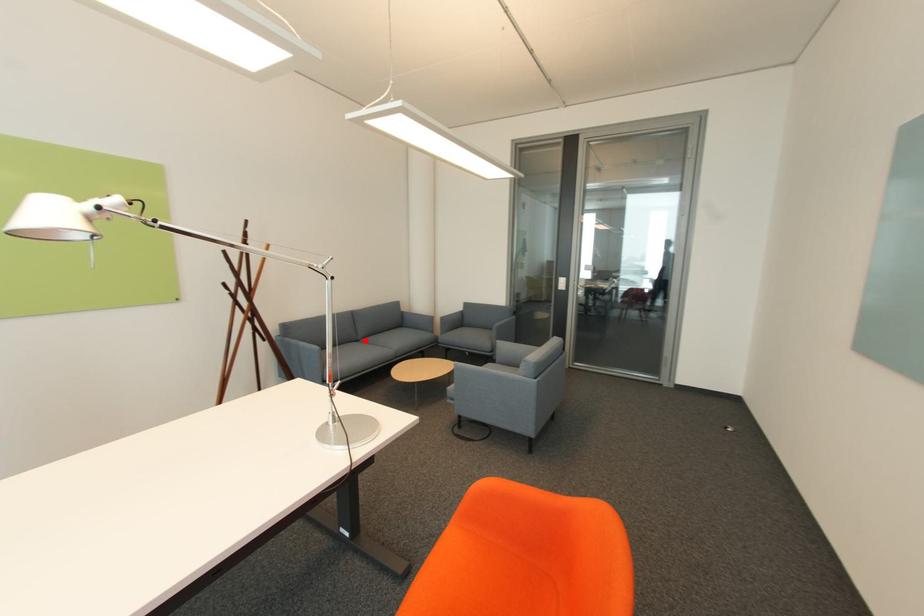
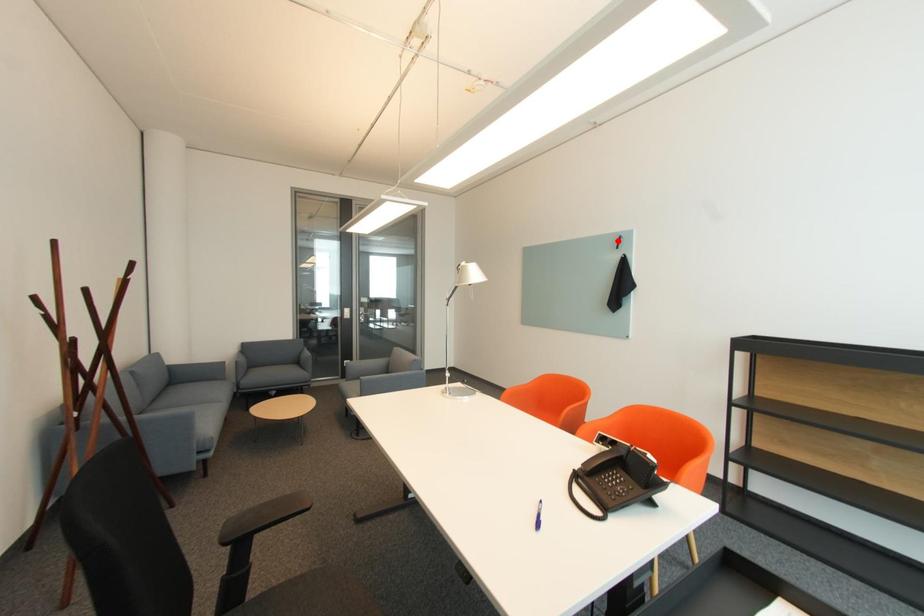
I am providing you with two images of the same scene from different viewpoints. A red point is marked on the first image and another point is marked on the second image. Does the point marked in image1 correspond to the same location as the one in image2?

No